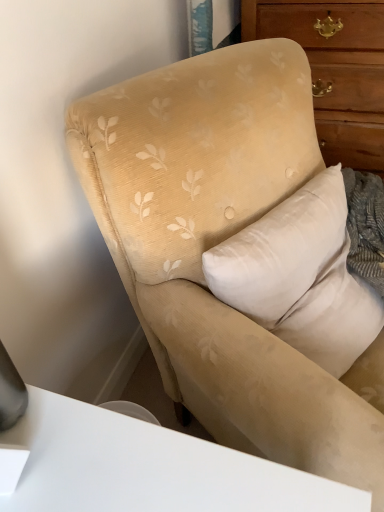
The width and height of the screenshot is (384, 512). What do you see at coordinates (335, 70) in the screenshot? I see `wooden chest of drawers at upper right` at bounding box center [335, 70].

Where is `wooden chest of drawers at upper right`? wooden chest of drawers at upper right is located at coordinates (335, 70).

At what (x,y) coordinates should I click in order to perform the action: click on wooden chest of drawers at upper right. Please return your answer as a coordinate pair (x, y). This screenshot has height=512, width=384. Looking at the image, I should click on (335, 70).